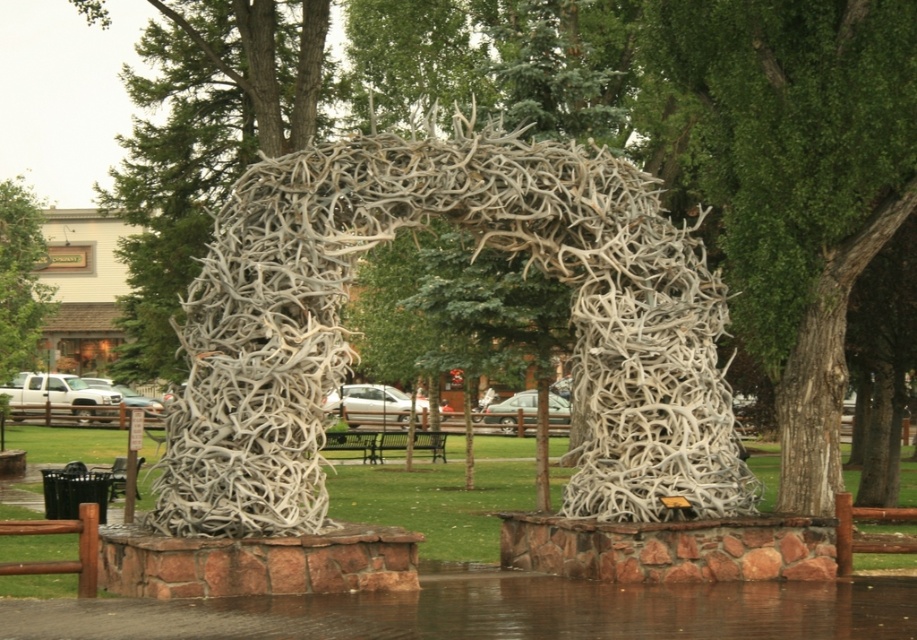
Is green leafy tree at center further to camera compared to green leafy tree at upper left?

That is False.

Which is in front, point (771, 259) or point (17, 362)?

Point (771, 259) is more forward.

I want to click on green leafy tree at center, so click(x=799, y=182).

Can you confirm if white antler arch at center is wider than green leafy tree at center?

Yes, white antler arch at center is wider than green leafy tree at center.

Between white antler arch at center and green leafy tree at center, which one is positioned lower?

white antler arch at center is lower down.

Between point (619, 365) and point (647, 4), which one is positioned behind?

The point (647, 4) is more distant.

This screenshot has width=917, height=640. I want to click on white antler arch at center, so [x=481, y=246].

Between white antler arch at center and green leafy tree at upper left, which one is positioned lower?

Positioned lower is white antler arch at center.

Who is more distant from viewer, [484,236] or [1,360]?

The point [1,360] is behind.

Locate an element on the screen. This screenshot has height=640, width=917. white antler arch at center is located at coordinates (481, 246).

Where is `white antler arch at center`? The height and width of the screenshot is (640, 917). white antler arch at center is located at coordinates (481, 246).